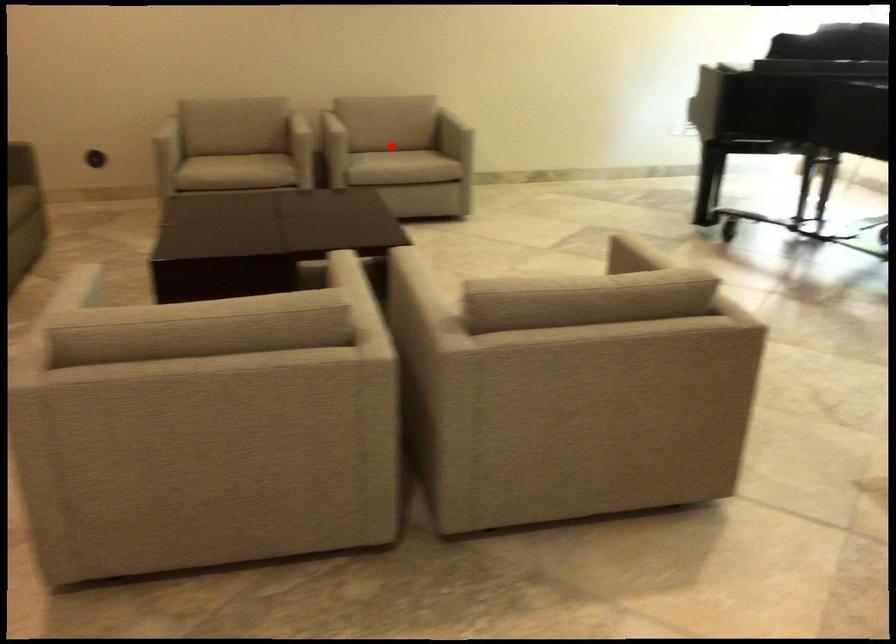
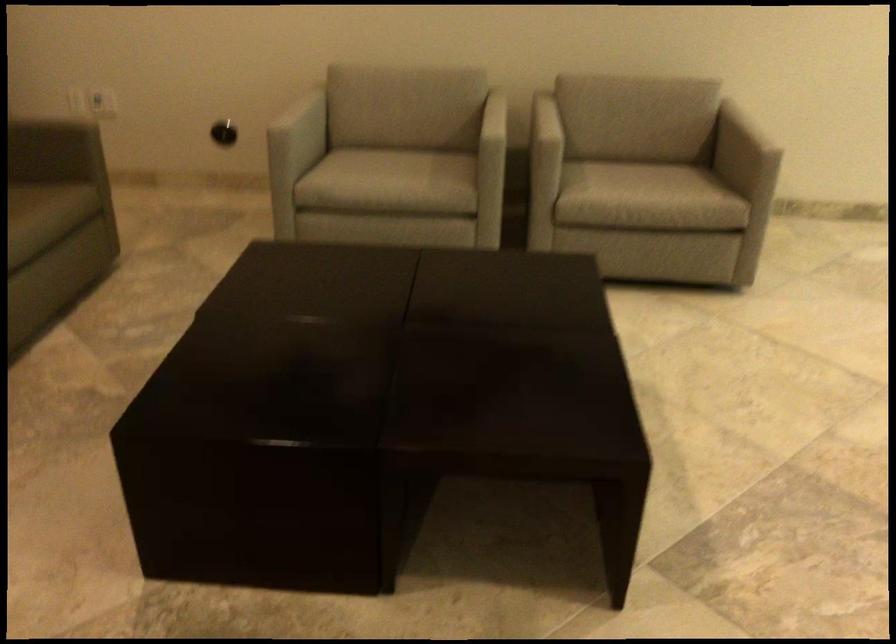
Where in the second image is the point corresponding to the highlighted location from the first image?

(633, 160)